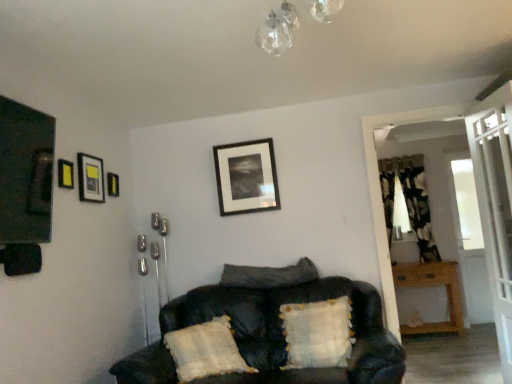
Question: Should I look upward or downward to see matte black picture frame at upper left, the second picture frame in the left-to-right sequence?

Choices:
 (A) down
 (B) up

Answer: (B)

Question: Is velvety dark gray pillow at center, arranged as the second pillow when viewed from the left, aimed at clear glass chandelier at upper center?

Choices:
 (A) no
 (B) yes

Answer: (A)

Question: From the image's perspective, is velvety dark gray pillow at center, which is counted as the second pillow, starting from the right, on clear glass chandelier at upper center?

Choices:
 (A) no
 (B) yes

Answer: (A)

Question: Does velvety dark gray pillow at center, which is counted as the second pillow, starting from the right, appear on the right side of clear glass chandelier at upper center?

Choices:
 (A) no
 (B) yes

Answer: (A)

Question: Can you confirm if velvety dark gray pillow at center, arranged as the second pillow when viewed from the left, is bigger than clear glass chandelier at upper center?

Choices:
 (A) yes
 (B) no

Answer: (A)

Question: From a real-world perspective, does velvety dark gray pillow at center, which is counted as the second pillow, starting from the right, sit lower than clear glass chandelier at upper center?

Choices:
 (A) no
 (B) yes

Answer: (B)

Question: Can you confirm if velvety dark gray pillow at center, which is counted as the second pillow, starting from the right, is smaller than clear glass chandelier at upper center?

Choices:
 (A) yes
 (B) no

Answer: (B)

Question: Is wooden table at right shorter than floral fabric curtain at right?

Choices:
 (A) yes
 (B) no

Answer: (A)

Question: Is wooden table at right in contact with floral fabric curtain at right?

Choices:
 (A) no
 (B) yes

Answer: (A)

Question: Considering the relative sizes of wooden table at right and floral fabric curtain at right in the image provided, is wooden table at right smaller than floral fabric curtain at right?

Choices:
 (A) yes
 (B) no

Answer: (B)

Question: Is wooden table at right outside floral fabric curtain at right?

Choices:
 (A) yes
 (B) no

Answer: (A)

Question: From a real-world perspective, is wooden table at right below floral fabric curtain at right?

Choices:
 (A) yes
 (B) no

Answer: (A)

Question: Considering the relative positions of wooden table at right and floral fabric curtain at right in the image provided, is wooden table at right to the left of floral fabric curtain at right from the viewer's perspective?

Choices:
 (A) no
 (B) yes

Answer: (A)

Question: Does white textured pillow at lower center, the third pillow from the right, turn towards black leather couch at center?

Choices:
 (A) no
 (B) yes

Answer: (B)